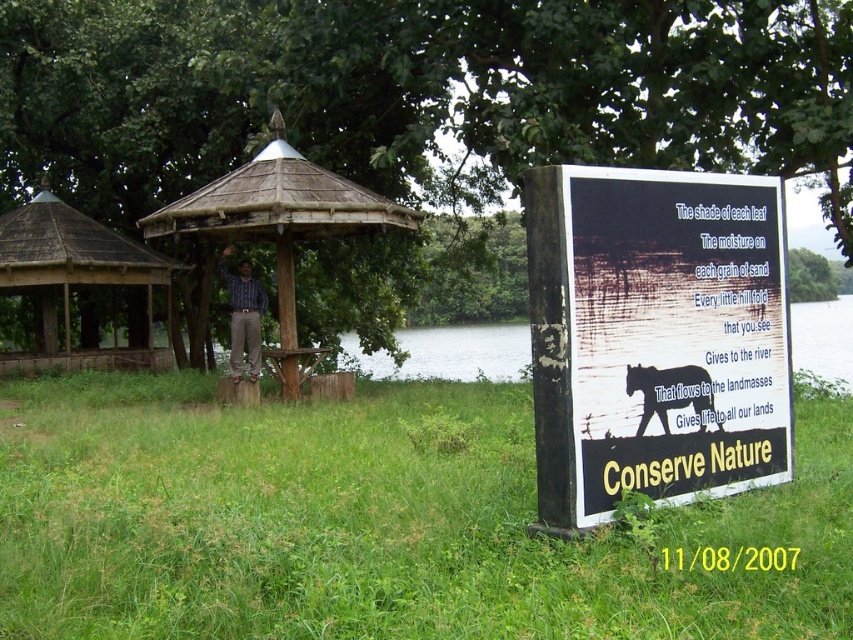
Question: Is green leafy tree at upper center thinner than brown wooden hut at left?

Choices:
 (A) yes
 (B) no

Answer: (B)

Question: Can you confirm if brown wooden hut at left is positioned to the right of silhouette glossy black bear at right?

Choices:
 (A) no
 (B) yes

Answer: (A)

Question: Which of the following is the closest to the observer?

Choices:
 (A) black wood sign at right
 (B) green leafy tree at upper center
 (C) wooden gazebo at center
 (D) brown wooden hut at left

Answer: (A)

Question: Which is farther from the black wood sign at right?

Choices:
 (A) brown wooden hut at left
 (B) green grassy at right

Answer: (A)

Question: Which point is farther to the camera?

Choices:
 (A) (643, 81)
 (B) (555, 387)
 (C) (318, 515)
 (D) (144, 272)

Answer: (D)

Question: Does green grassy at right appear over wooden gazebo at center?

Choices:
 (A) yes
 (B) no

Answer: (B)